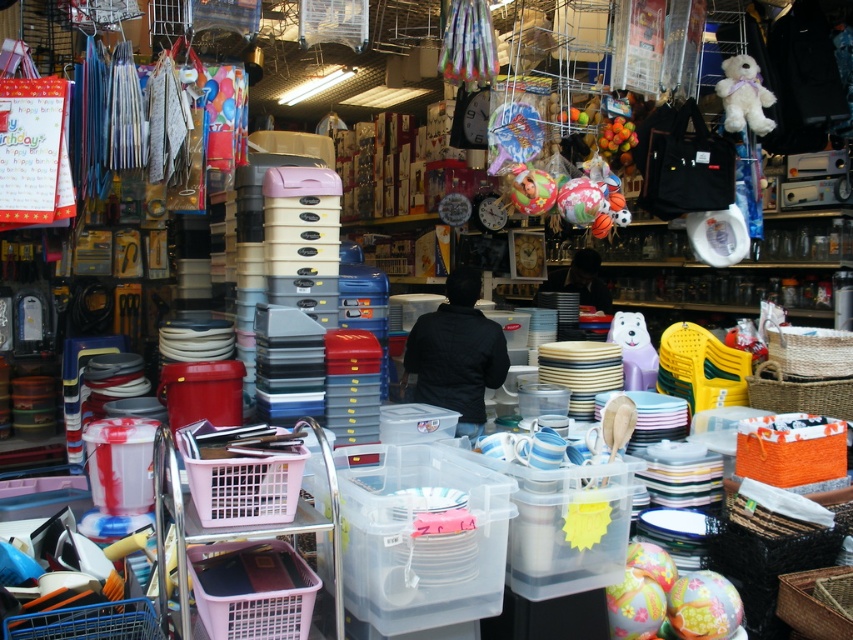
You are at a market stall and see the black matte jacket at center and the purple plastic bear at center. Which item takes up more space in the stall?

The black matte jacket at center is bigger than the purple plastic bear at center, so it takes up more space in the stall.

You are a customer at the market stall holding a 1.2 meter long box. You want to place it between the white plush bear at upper right and the matte green ball at center. Is there enough space?

The white plush bear at upper right and matte green ball at center are 1.38 meters apart, so yes, the box can be placed between them as the distance is greater than the box length.

You are a customer at the market stall and want to pick up the black matte jacket at center and the matte green ball at center. Which item should you pick up first to avoid disturbing the other?

You should pick up the matte green ball at center first because it is positioned above the black matte jacket at center, so removing it first will prevent disturbing the jacket below.